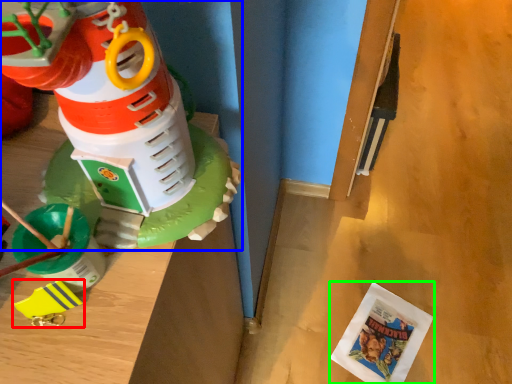
Question: Estimate the real-world distances between objects in this image. Which object is farther from toy (highlighted by a red box), toy (highlighted by a blue box) or comic book (highlighted by a green box)?

Choices:
 (A) toy
 (B) comic book

Answer: (B)